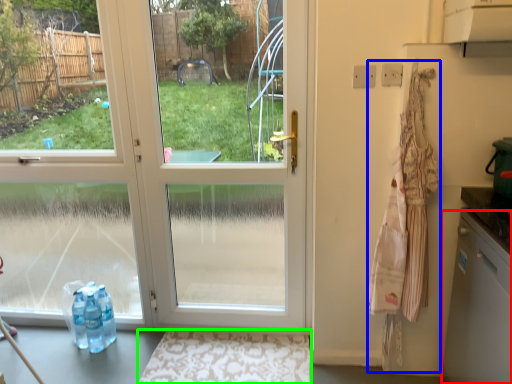
Question: Estimate the real-world distances between objects in this image. Which object is closer to dish washer (highlighted by a red box), laundry (highlighted by a blue box) or doormat (highlighted by a green box)?

Choices:
 (A) laundry
 (B) doormat

Answer: (A)